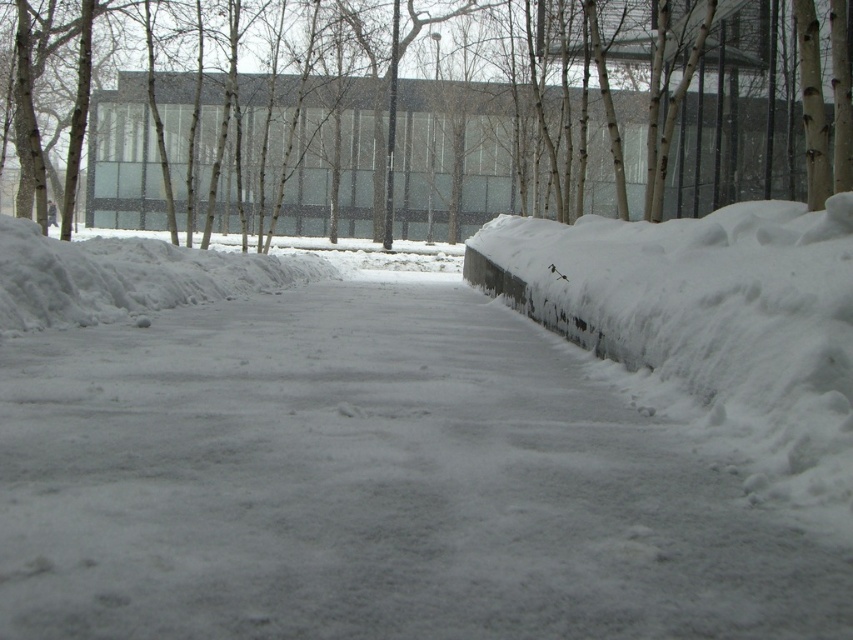
Question: Which point is farther from the camera taking this photo?

Choices:
 (A) (662, 259)
 (B) (386, 205)

Answer: (B)

Question: Where is brown smooth tree at upper center located in relation to white fluffy snow at right in the image?

Choices:
 (A) below
 (B) above

Answer: (B)

Question: Which of the following is the farthest from the observer?

Choices:
 (A) (285, 205)
 (B) (780, 285)

Answer: (A)

Question: Which object is farther from the camera taking this photo?

Choices:
 (A) brown smooth tree at upper center
 (B) white fluffy snow at right

Answer: (A)

Question: Is brown smooth tree at upper center smaller than white fluffy snow at right?

Choices:
 (A) no
 (B) yes

Answer: (A)

Question: Observing the image, what is the correct spatial positioning of brown smooth tree at upper center in reference to white fluffy snow at right?

Choices:
 (A) right
 (B) left

Answer: (B)